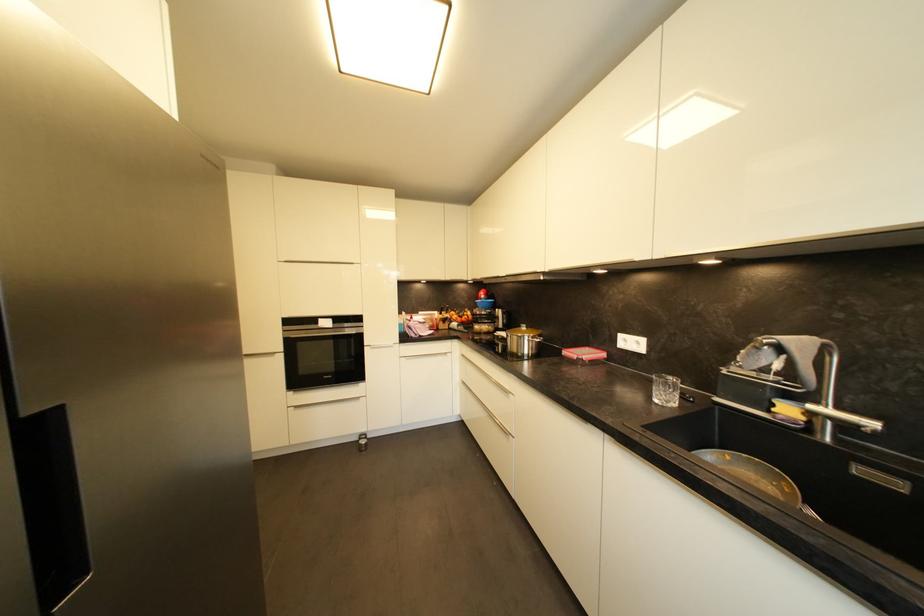
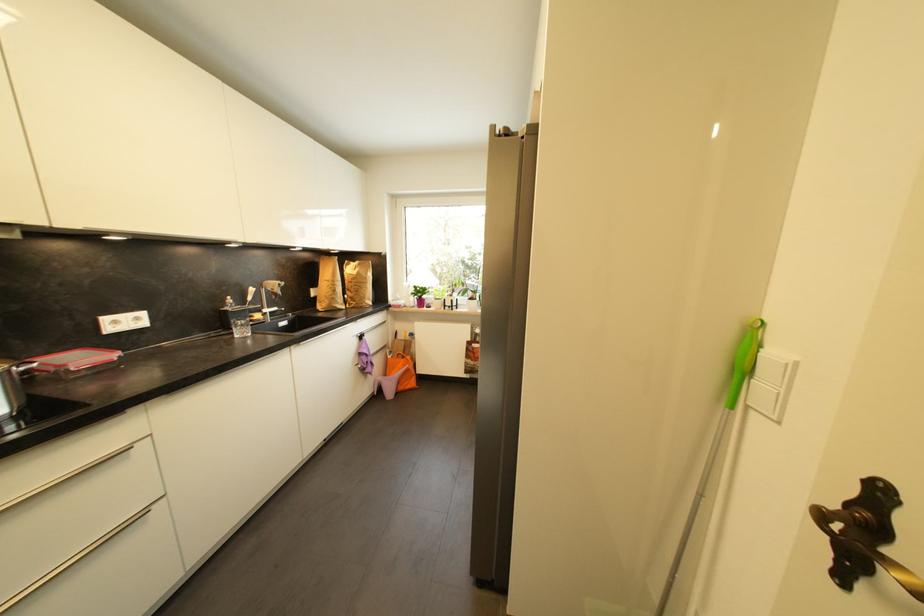
In the second image, find the point that corresponds to [602,350] in the first image.

(54, 355)